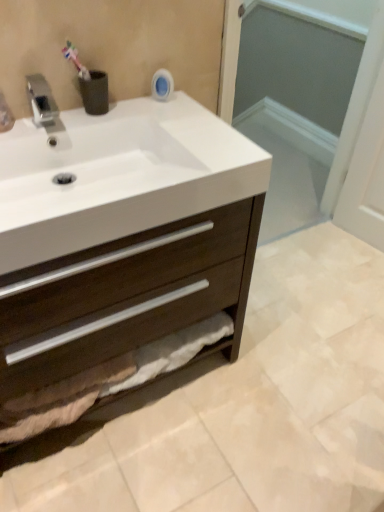
Question: Can you confirm if dark wood cabinet at center is positioned to the left of white glossy sink at upper left?

Choices:
 (A) yes
 (B) no

Answer: (A)

Question: Is dark wood cabinet at center facing towards white glossy sink at upper left?

Choices:
 (A) no
 (B) yes

Answer: (A)

Question: From a real-world perspective, is dark wood cabinet at center physically below white glossy sink at upper left?

Choices:
 (A) yes
 (B) no

Answer: (A)

Question: Is white glossy sink at upper left a part of dark wood cabinet at center?

Choices:
 (A) no
 (B) yes

Answer: (B)

Question: Can you confirm if dark wood cabinet at center is smaller than white glossy sink at upper left?

Choices:
 (A) yes
 (B) no

Answer: (B)

Question: Considering the relative positions of dark wood cabinet at center and silver metallic faucet at upper left in the image provided, is dark wood cabinet at center to the left or to the right of silver metallic faucet at upper left?

Choices:
 (A) left
 (B) right

Answer: (B)

Question: From a real-world perspective, is dark wood cabinet at center positioned above or below silver metallic faucet at upper left?

Choices:
 (A) above
 (B) below

Answer: (B)

Question: Considering the positions of dark wood cabinet at center and silver metallic faucet at upper left in the image, is dark wood cabinet at center wider or thinner than silver metallic faucet at upper left?

Choices:
 (A) wide
 (B) thin

Answer: (A)

Question: Would you say dark wood cabinet at center is inside or outside silver metallic faucet at upper left?

Choices:
 (A) inside
 (B) outside

Answer: (B)

Question: In terms of height, does transparent glass screen door at upper center look taller or shorter compared to dark wood cabinet at center?

Choices:
 (A) tall
 (B) short

Answer: (A)

Question: In the image, is transparent glass screen door at upper center on the left side or the right side of dark wood cabinet at center?

Choices:
 (A) left
 (B) right

Answer: (B)

Question: In terms of size, does transparent glass screen door at upper center appear bigger or smaller than dark wood cabinet at center?

Choices:
 (A) big
 (B) small

Answer: (B)

Question: From the image's perspective, is transparent glass screen door at upper center located above or below dark wood cabinet at center?

Choices:
 (A) above
 (B) below

Answer: (A)

Question: Is transparent glass screen door at upper center inside or outside of silver metallic faucet at upper left?

Choices:
 (A) outside
 (B) inside

Answer: (A)

Question: Relative to silver metallic faucet at upper left, is transparent glass screen door at upper center in front or behind?

Choices:
 (A) behind
 (B) front

Answer: (A)